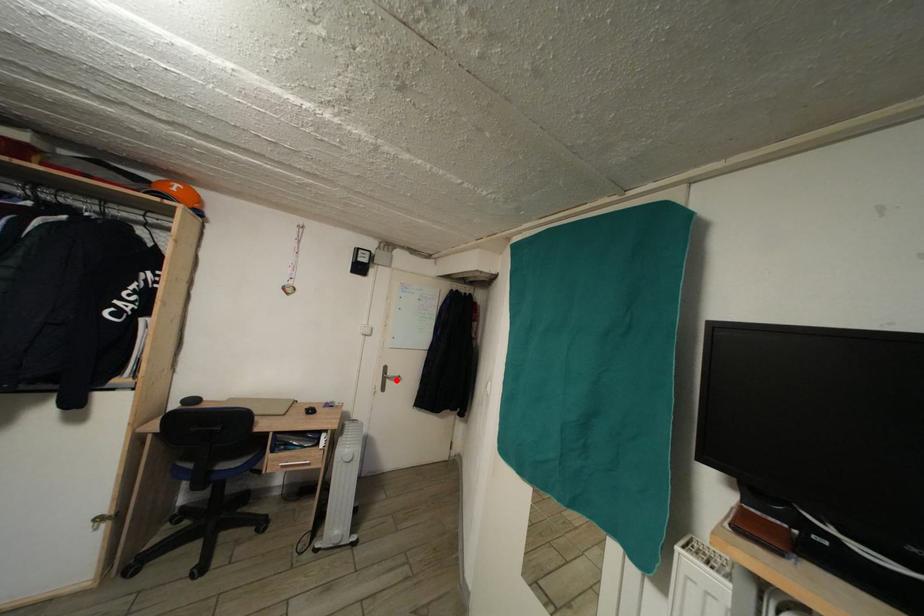
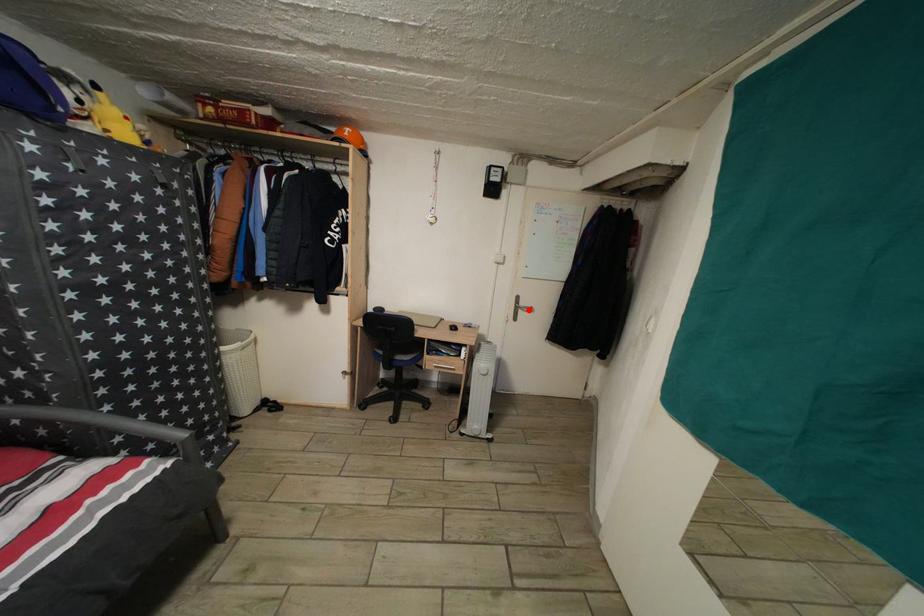
I am providing you with two images of the same scene from different viewpoints. A red point is marked on the first image and another point is marked on the second image. Is the marked point in image1 the same physical position as the marked point in image2?

Yes